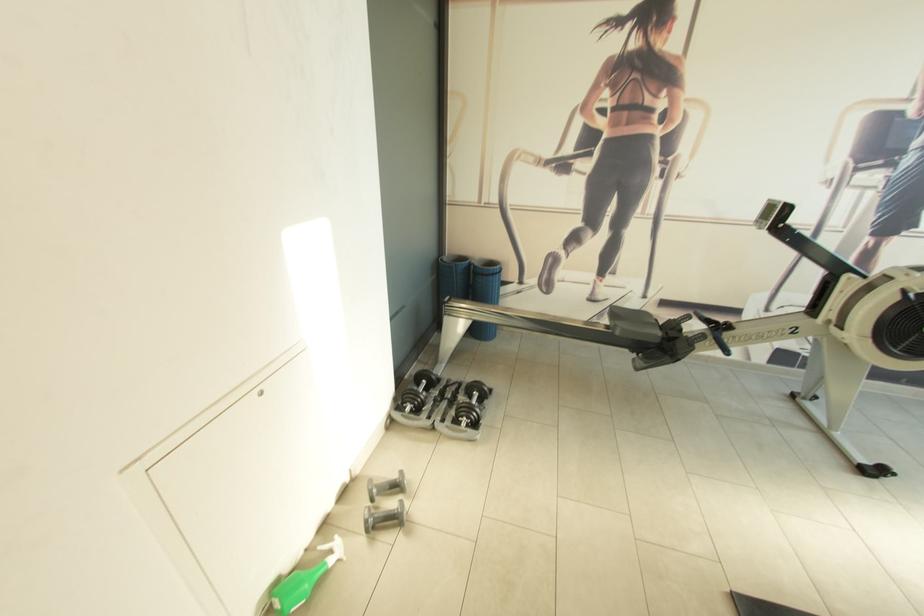
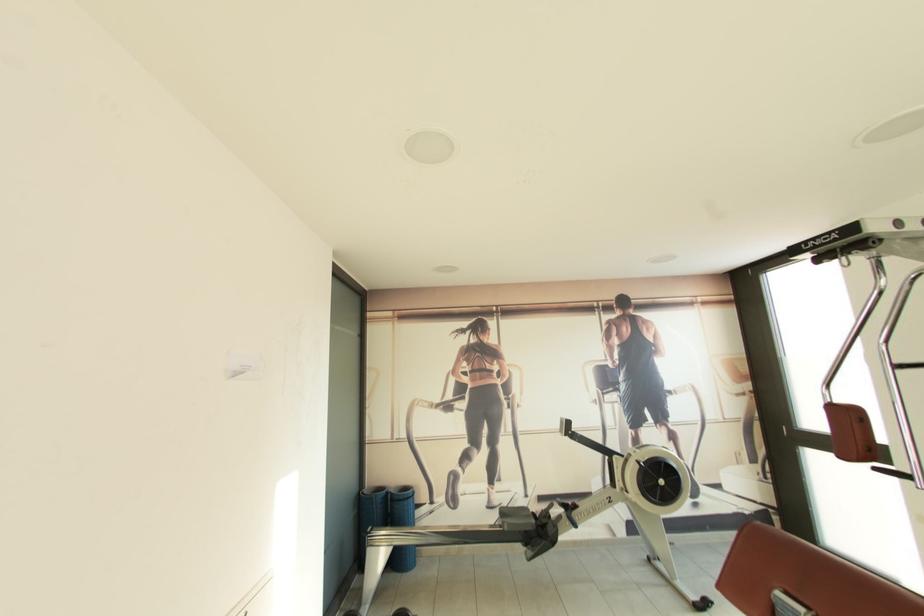
Find the pixel in the second image that matches (720,323) in the first image.

(573, 507)